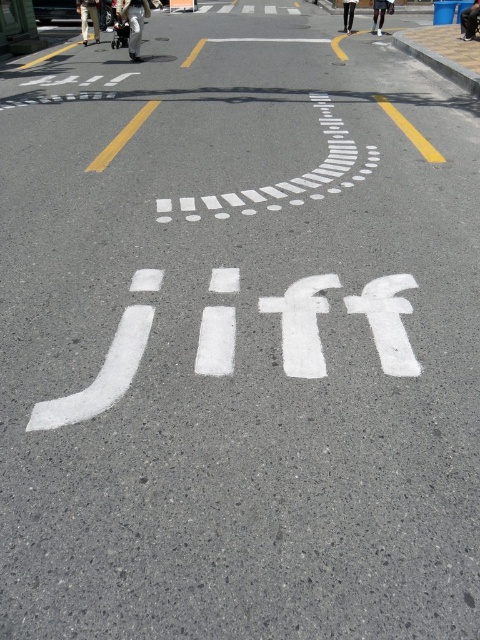
Is light gray fabric jacket at upper center taller than black pants at upper center?

Yes.

Is light gray fabric jacket at upper center smaller than black pants at upper center?

Actually, light gray fabric jacket at upper center might be larger than black pants at upper center.

Where is `light gray fabric jacket at upper center`? light gray fabric jacket at upper center is located at coordinates [133, 22].

Who is more forward, (464,13) or (372,17)?

Point (464,13)

Is point (468, 26) positioned after point (374, 13)?

That is False.

Image resolution: width=480 pixels, height=640 pixels. I want to click on dark blue jeans at center, so click(x=469, y=20).

Does light gray fabric jacket at upper center have a greater width compared to khaki pants at center?

Indeed, light gray fabric jacket at upper center has a greater width compared to khaki pants at center.

The width and height of the screenshot is (480, 640). In order to click on light gray fabric jacket at upper center in this screenshot , I will do `click(133, 22)`.